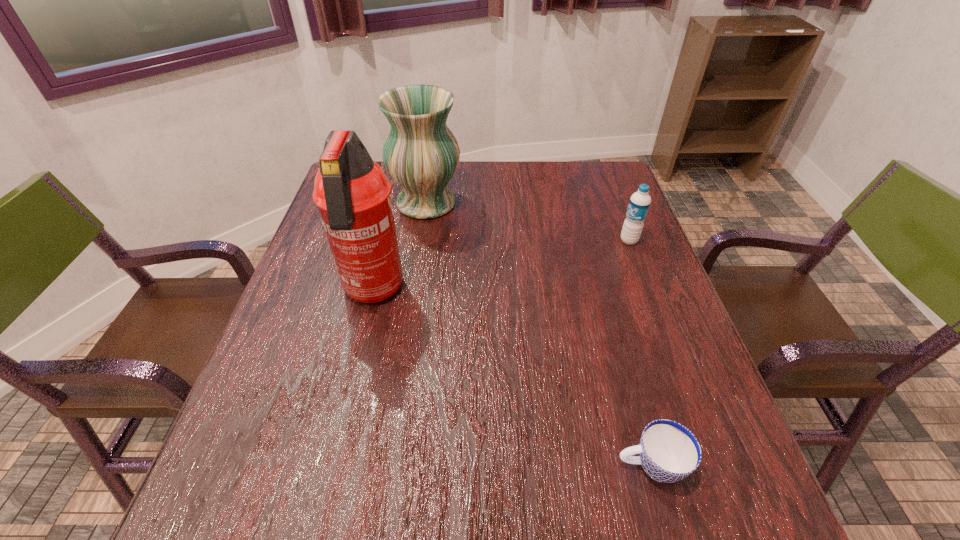
Find the location of a particular element. This screenshot has height=540, width=960. fire extinguisher is located at coordinates (352, 193).

Locate an element on the screen. This screenshot has height=540, width=960. the tallest object is located at coordinates (352, 193).

The width and height of the screenshot is (960, 540). I want to click on the farthest object, so click(x=421, y=154).

Where is `the third shortest object`? The image size is (960, 540). the third shortest object is located at coordinates (421, 154).

At what (x,y) coordinates should I click in order to perform the action: click on the rightmost object. Please return your answer as a coordinate pair (x, y). Image resolution: width=960 pixels, height=540 pixels. Looking at the image, I should click on (640, 201).

You are a GUI agent. You are given a task and a screenshot of the screen. Output one action in this format:
    pyautogui.click(x=<x>, y=<y>)
    Task: Click on the water bottle
    
    Given the screenshot: What is the action you would take?
    pyautogui.click(x=640, y=201)

Locate an element on the screen. the shortest object is located at coordinates (669, 452).

I want to click on cup, so click(669, 452).

Locate an element on the screen. The height and width of the screenshot is (540, 960). vacant region located 0.150m on the trigger side of the second nearest object is located at coordinates (350, 382).

Locate an element on the screen. vacant region located 0.210m on the right of the vase is located at coordinates (532, 203).